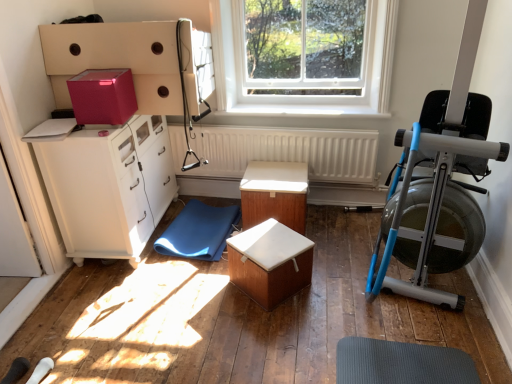
Locate an element on the screen. vacant area on top of wooden table at center, placed as the second table when sorted from front to back (from a real-world perspective) is located at coordinates (270, 177).